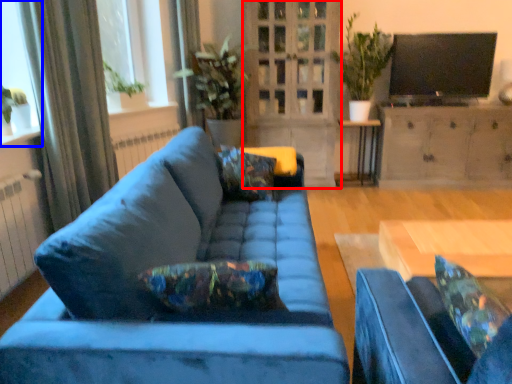
Question: Among these objects, which one is farthest to the camera, glass door (highlighted by a red box) or window (highlighted by a blue box)?

Choices:
 (A) glass door
 (B) window

Answer: (A)